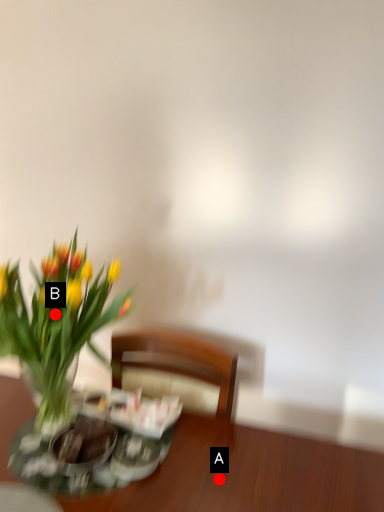
Question: Two points are circled on the image, labeled by A and B beside each circle. Among these points, which one is farthest from the camera?

Choices:
 (A) A is further
 (B) B is further

Answer: (B)